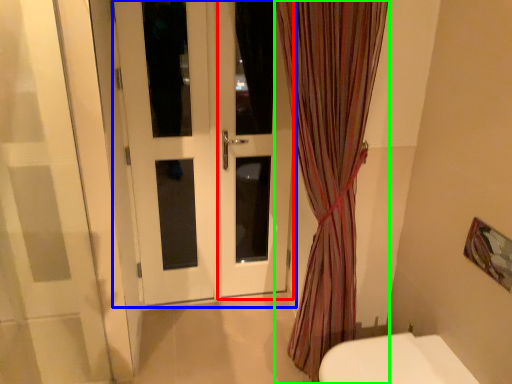
Question: Which is nearer to the screen door (highlighted by a red box)? door (highlighted by a blue box) or curtain (highlighted by a green box).

Choices:
 (A) door
 (B) curtain

Answer: (A)